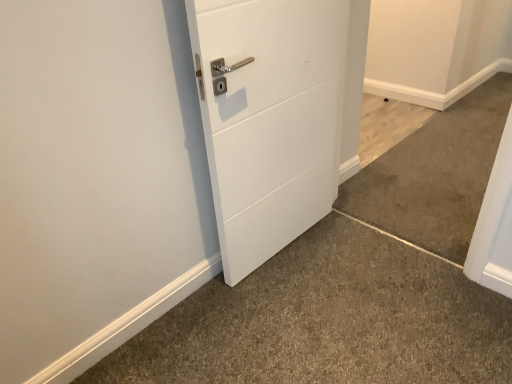
This screenshot has height=384, width=512. What do you see at coordinates (327, 321) in the screenshot?
I see `gray carpet at lower left, placed as the 1th concrete when sorted from bottom to top` at bounding box center [327, 321].

Image resolution: width=512 pixels, height=384 pixels. In order to click on gray carpet at lower left, positioned as the third concrete in top-to-bottom order in this screenshot , I will do `click(327, 321)`.

What do you see at coordinates (269, 118) in the screenshot? This screenshot has height=384, width=512. I see `white matte door at center` at bounding box center [269, 118].

You are a GUI agent. You are given a task and a screenshot of the screen. Output one action in this format:
    pyautogui.click(x=<x>, y=<y>)
    Task: Click on the gray carpet at lower left, positioned as the third concrete in top-to-bottom order
    This screenshot has width=512, height=384.
    Given the screenshot: What is the action you would take?
    pyautogui.click(x=327, y=321)

Could you measure the distance between light brown wood floor at lower right, positioned as the 3th concrete in bottom-to-top order, and white matte door at center?

They are 1.15 meters apart.

From the image's perspective, between light brown wood floor at lower right, positioned as the 3th concrete in bottom-to-top order, and white matte door at center, who is located below?

From the image's view, white matte door at center is below.

Who is bigger, light brown wood floor at lower right, positioned as the first concrete in top-to-bottom order, or white matte door at center?

white matte door at center.

Can you see light brown wood floor at lower right, positioned as the first concrete in top-to-bottom order, touching white matte door at center?

No, light brown wood floor at lower right, positioned as the first concrete in top-to-bottom order, is not in contact with white matte door at center.

Which of these two, brown carpet at lower right, which ranks as the second concrete in top-to-bottom order, or white matte door at center, is wider?

brown carpet at lower right, which ranks as the second concrete in top-to-bottom order.

From the image's perspective, which is below, brown carpet at lower right, which ranks as the second concrete in top-to-bottom order, or white matte door at center?

white matte door at center is shown below in the image.

Between brown carpet at lower right, which appears as the second concrete when ordered from the bottom, and white matte door at center, which one appears on the right side from the viewer's perspective?

brown carpet at lower right, which appears as the second concrete when ordered from the bottom.

Which is less distant, (434, 158) or (247, 32)?

Point (434, 158) is farther from the camera than point (247, 32).

Which object is positioned more to the left, gray carpet at lower left, placed as the 1th concrete when sorted from bottom to top, or white matte door at center?

white matte door at center.

Is gray carpet at lower left, placed as the 1th concrete when sorted from bottom to top, taller than white matte door at center?

In fact, gray carpet at lower left, placed as the 1th concrete when sorted from bottom to top, may be shorter than white matte door at center.

Does gray carpet at lower left, positioned as the third concrete in top-to-bottom order, contain white matte door at center?

Definitely not — white matte door at center is not inside gray carpet at lower left, positioned as the third concrete in top-to-bottom order.

The height and width of the screenshot is (384, 512). In the image, there is a white matte door at center. In order to click on concrete below it (from the image's perspective) in this screenshot , I will do `click(327, 321)`.

Which is more distant, (370, 117) or (466, 242)?

Point (370, 117)

Which is behind, light brown wood floor at lower right, positioned as the first concrete in top-to-bottom order, or brown carpet at lower right, which ranks as the second concrete in top-to-bottom order?

light brown wood floor at lower right, positioned as the first concrete in top-to-bottom order.

Starting from the light brown wood floor at lower right, positioned as the 3th concrete in bottom-to-top order, which concrete is the 1st one in front? Please provide its 2D coordinates.

[(435, 174)]

Can you see light brown wood floor at lower right, positioned as the 3th concrete in bottom-to-top order, touching brown carpet at lower right, which appears as the second concrete when ordered from the bottom?

They are not placed beside each other.

From a real-world perspective, who is located higher, brown carpet at lower right, which ranks as the second concrete in top-to-bottom order, or light brown wood floor at lower right, positioned as the first concrete in top-to-bottom order?

brown carpet at lower right, which ranks as the second concrete in top-to-bottom order.

Is brown carpet at lower right, which appears as the second concrete when ordered from the bottom, positioned in front of light brown wood floor at lower right, positioned as the 3th concrete in bottom-to-top order?

Yes, the depth of brown carpet at lower right, which appears as the second concrete when ordered from the bottom, is less than that of light brown wood floor at lower right, positioned as the 3th concrete in bottom-to-top order.

Which point is more forward, (x=352, y=184) or (x=377, y=99)?

The point (x=352, y=184) is closer.

Would you consider brown carpet at lower right, which ranks as the second concrete in top-to-bottom order, to be distant from light brown wood floor at lower right, positioned as the first concrete in top-to-bottom order?

Actually, brown carpet at lower right, which ranks as the second concrete in top-to-bottom order, and light brown wood floor at lower right, positioned as the first concrete in top-to-bottom order, are a little close together.

Is point (506, 364) positioned after point (453, 164)?

No, (506, 364) is closer to viewer.

How different are the orientations of gray carpet at lower left, positioned as the third concrete in top-to-bottom order, and brown carpet at lower right, which appears as the second concrete when ordered from the bottom, in degrees?

91.3 degrees separate the facing orientations of gray carpet at lower left, positioned as the third concrete in top-to-bottom order, and brown carpet at lower right, which appears as the second concrete when ordered from the bottom.

From a real-world perspective, which is physically below, gray carpet at lower left, placed as the 1th concrete when sorted from bottom to top, or brown carpet at lower right, which ranks as the second concrete in top-to-bottom order?

gray carpet at lower left, placed as the 1th concrete when sorted from bottom to top.

From the image's perspective, which one is positioned higher, gray carpet at lower left, placed as the 1th concrete when sorted from bottom to top, or brown carpet at lower right, which ranks as the second concrete in top-to-bottom order?

brown carpet at lower right, which ranks as the second concrete in top-to-bottom order, is shown above in the image.

I want to click on the 2nd concrete above when counting from the white matte door at center (from the image's perspective), so click(x=386, y=125).

Which is nearer, (223, 36) or (377, 128)?

The point (223, 36) is more forward.

Can we say white matte door at center lies outside light brown wood floor at lower right, positioned as the 3th concrete in bottom-to-top order?

white matte door at center lies outside light brown wood floor at lower right, positioned as the 3th concrete in bottom-to-top order,'s area.

Which object is closer to the camera taking this photo, white matte door at center or light brown wood floor at lower right, positioned as the 3th concrete in bottom-to-top order?

white matte door at center is closer to the camera.

This screenshot has height=384, width=512. There is a white matte door at center. What are the coordinates of `the 2nd concrete above it (from the image's perspective)` in the screenshot? It's located at (386, 125).

In order to click on door below the brown carpet at lower right, which appears as the second concrete when ordered from the bottom (from the image's perspective) in this screenshot , I will do `click(269, 118)`.

Which object lies further to the anchor point brown carpet at lower right, which appears as the second concrete when ordered from the bottom, white matte door at center or light brown wood floor at lower right, positioned as the 3th concrete in bottom-to-top order?

white matte door at center.

Looking at the image, which one is located further to light brown wood floor at lower right, positioned as the 3th concrete in bottom-to-top order, gray carpet at lower left, placed as the 1th concrete when sorted from bottom to top, or white matte door at center?

The object further to light brown wood floor at lower right, positioned as the 3th concrete in bottom-to-top order, is gray carpet at lower left, placed as the 1th concrete when sorted from bottom to top.

Estimate the real-world distances between objects in this image. Which object is further from gray carpet at lower left, positioned as the third concrete in top-to-bottom order, brown carpet at lower right, which appears as the second concrete when ordered from the bottom, or light brown wood floor at lower right, positioned as the 3th concrete in bottom-to-top order?

light brown wood floor at lower right, positioned as the 3th concrete in bottom-to-top order.

Based on their spatial positions, is brown carpet at lower right, which appears as the second concrete when ordered from the bottom, or white matte door at center closer to gray carpet at lower left, placed as the 1th concrete when sorted from bottom to top?

Based on the image, white matte door at center appears to be nearer to gray carpet at lower left, placed as the 1th concrete when sorted from bottom to top.

Estimate the real-world distances between objects in this image. Which object is further from gray carpet at lower left, placed as the 1th concrete when sorted from bottom to top, light brown wood floor at lower right, positioned as the 3th concrete in bottom-to-top order, or white matte door at center?

The object further to gray carpet at lower left, placed as the 1th concrete when sorted from bottom to top, is light brown wood floor at lower right, positioned as the 3th concrete in bottom-to-top order.

Which object lies nearer to the anchor point white matte door at center, gray carpet at lower left, placed as the 1th concrete when sorted from bottom to top, or light brown wood floor at lower right, positioned as the first concrete in top-to-bottom order?

gray carpet at lower left, placed as the 1th concrete when sorted from bottom to top, is closer to white matte door at center.

Based on the photo, from the image, which object appears to be farther from white matte door at center, light brown wood floor at lower right, positioned as the first concrete in top-to-bottom order, or gray carpet at lower left, placed as the 1th concrete when sorted from bottom to top?

light brown wood floor at lower right, positioned as the first concrete in top-to-bottom order, is further to white matte door at center.

Based on their spatial positions, is brown carpet at lower right, which appears as the second concrete when ordered from the bottom, or gray carpet at lower left, positioned as the third concrete in top-to-bottom order, further from white matte door at center?

brown carpet at lower right, which appears as the second concrete when ordered from the bottom, is positioned further to the anchor white matte door at center.

Locate an element on the screen. door between gray carpet at lower left, positioned as the third concrete in top-to-bottom order, and light brown wood floor at lower right, positioned as the 3th concrete in bottom-to-top order, in the front-back direction is located at coordinates (269, 118).

The width and height of the screenshot is (512, 384). What are the coordinates of `concrete between gray carpet at lower left, positioned as the third concrete in top-to-bottom order, and light brown wood floor at lower right, positioned as the 3th concrete in bottom-to-top order, from front to back` in the screenshot? It's located at (435, 174).